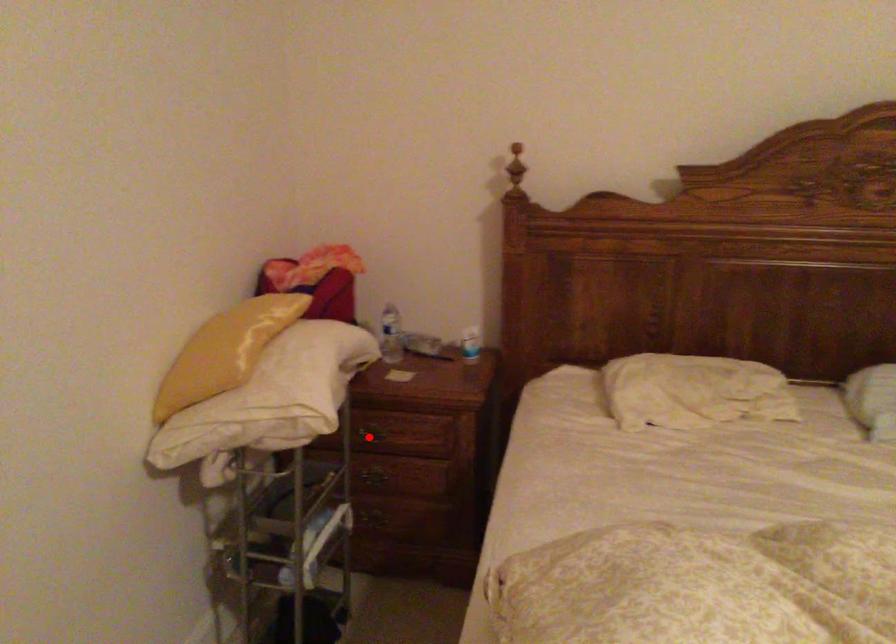
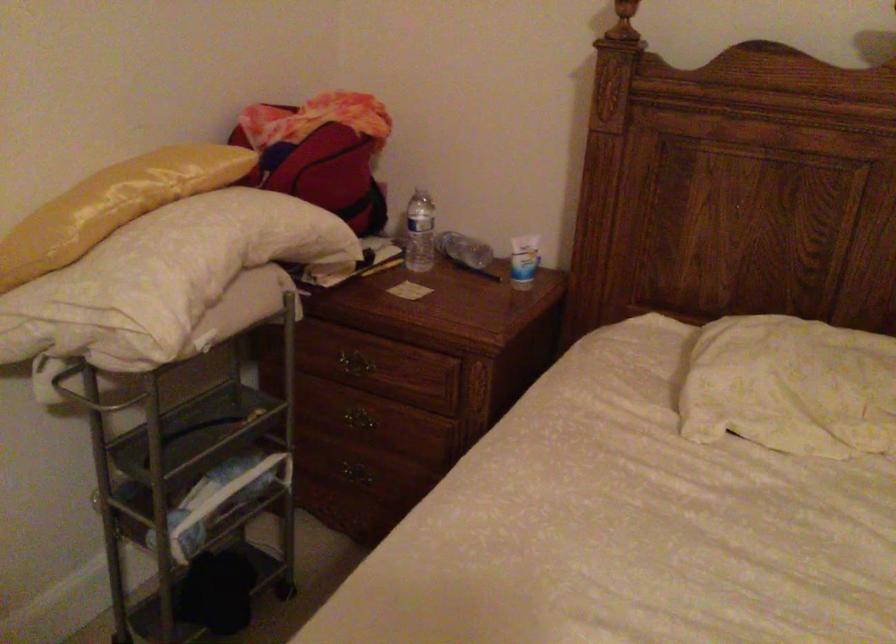
The point at the highlighted location is marked in the first image. Where is the corresponding point in the second image?

(350, 365)